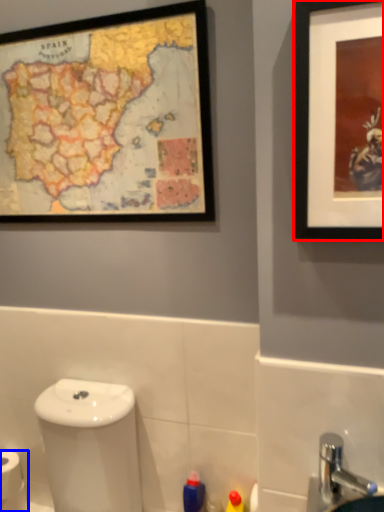
Question: Which point is closer to the camera, picture frame (highlighted by a red box) or toilet paper (highlighted by a blue box)?

Choices:
 (A) picture frame
 (B) toilet paper

Answer: (A)